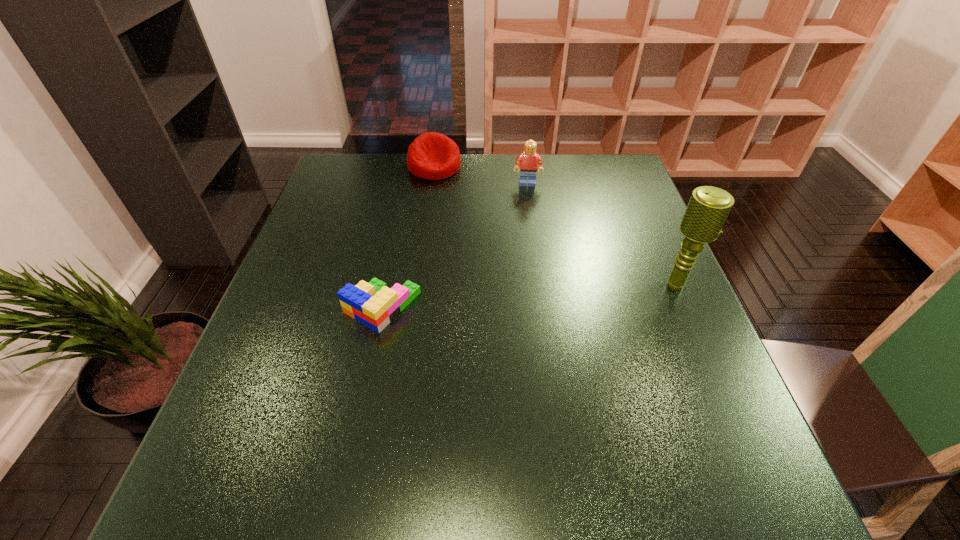
At what (x,y) coordinates should I click in order to perform the action: click on free spot on the desktop that is between the shorter Lego and the tallest object and is positioned on the front-facing side of the second tallest object. Please return your answer as a coordinate pair (x, y). Image resolution: width=960 pixels, height=540 pixels. Looking at the image, I should click on (530, 295).

What are the coordinates of `free spot on the desktop that is between the left Lego and the microphone and is positioned on the seat area of the second shortest object` in the screenshot? It's located at (522, 296).